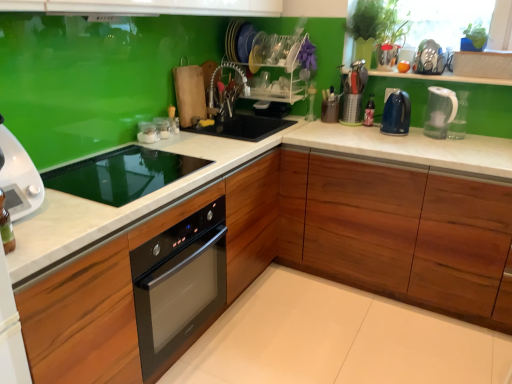
This screenshot has height=384, width=512. Identify the location of vacant area that is in front of clear plastic bottle at center, acting as the second bottle starting from the back. (377, 132).